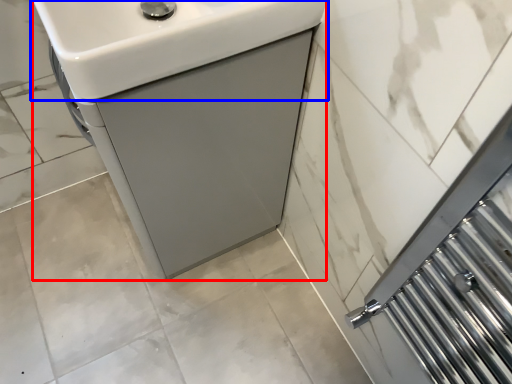
Question: Which object appears farthest to the camera in this image, sink (highlighted by a red box) or sink (highlighted by a blue box)?

Choices:
 (A) sink
 (B) sink

Answer: (A)